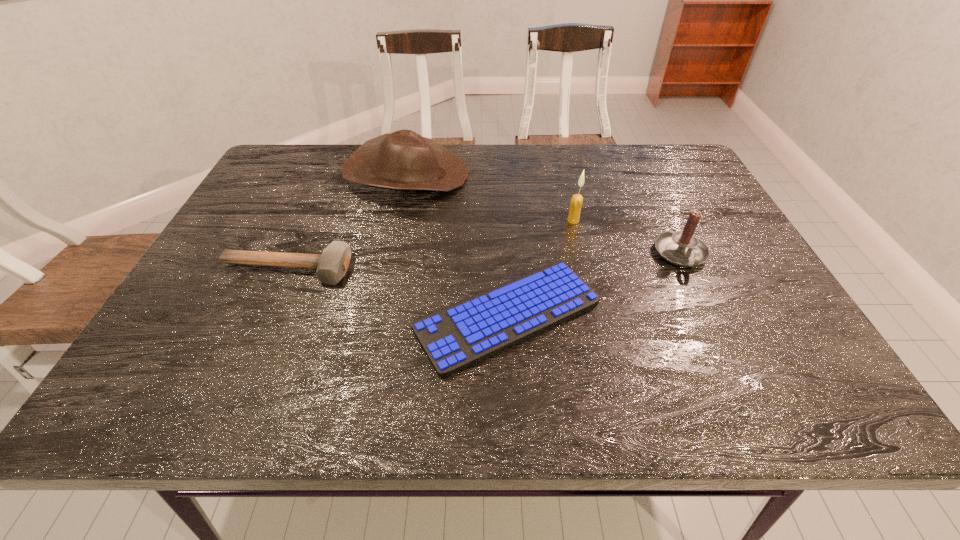
Where is `free space at the far left corner`? Image resolution: width=960 pixels, height=540 pixels. free space at the far left corner is located at coordinates (287, 166).

Locate an element on the screen. Image resolution: width=960 pixels, height=540 pixels. vacant position at the far right corner of the desktop is located at coordinates (639, 153).

Locate an element on the screen. free space between the computer keyboard and the right candle is located at coordinates (594, 286).

You are a GUI agent. You are given a task and a screenshot of the screen. Output one action in this format:
    pyautogui.click(x=<x>, y=<y>)
    Task: Click on the free point between the rightmost object and the computer keyboard
    The image size is (960, 540).
    Given the screenshot: What is the action you would take?
    pyautogui.click(x=594, y=286)

Where is `free spot between the mallet and the cowboy hat`? free spot between the mallet and the cowboy hat is located at coordinates click(347, 223).

Where is `unoccupied area between the farthest object and the mallet`? unoccupied area between the farthest object and the mallet is located at coordinates (347, 223).

You are a GUI agent. You are given a task and a screenshot of the screen. Output one action in this format:
    pyautogui.click(x=<x>, y=<y>)
    Task: Click on the vacant area that lies between the computer keyboard and the mallet
    Image resolution: width=960 pixels, height=540 pixels.
    Given the screenshot: What is the action you would take?
    pyautogui.click(x=397, y=293)

You are a GUI agent. You are given a task and a screenshot of the screen. Output one action in this format:
    pyautogui.click(x=<x>, y=<y>)
    Task: Click on the free area in between the farthest object and the computer keyboard
    
    Given the screenshot: What is the action you would take?
    pyautogui.click(x=457, y=246)

The image size is (960, 540). Identify the location of free space between the right candle and the farthest object. (543, 215).

Where is `free space between the mallet and the taller candle`? free space between the mallet and the taller candle is located at coordinates (430, 245).